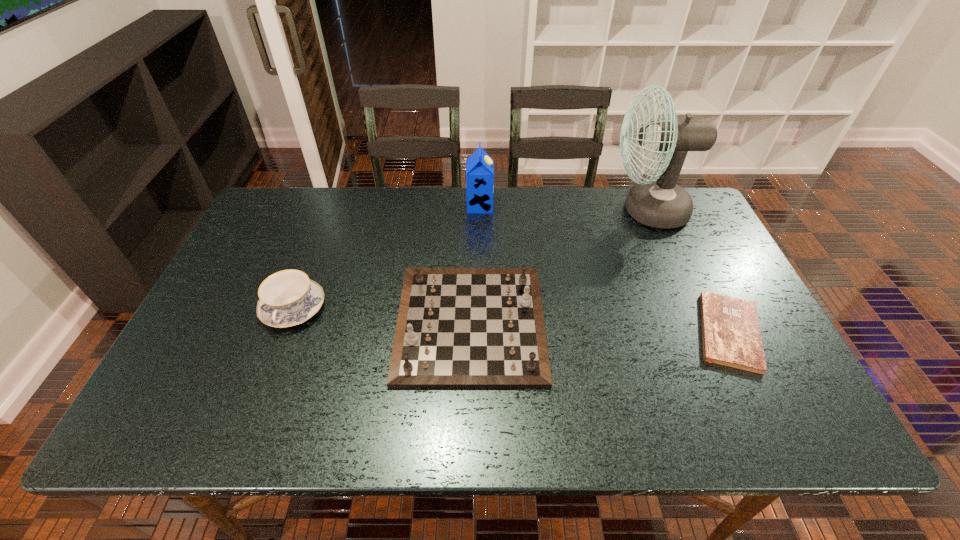
I want to click on the tallest object, so click(x=659, y=203).

This screenshot has height=540, width=960. I want to click on the fourth shortest object, so click(479, 166).

This screenshot has height=540, width=960. What are the coordinates of `chinaware` in the screenshot? It's located at (287, 298).

Find the location of a particular element. The image size is (960, 540). chessboard is located at coordinates (457, 327).

Identify the location of Bible. The image size is (960, 540). (731, 336).

Image resolution: width=960 pixels, height=540 pixels. Find the location of `vacant area located 0.380m in front of the fan where the airflow is directed`. vacant area located 0.380m in front of the fan where the airflow is directed is located at coordinates (488, 211).

You are a GUI agent. You are given a task and a screenshot of the screen. Output one action in this format:
    pyautogui.click(x=<x>, y=<y>)
    Task: Click on the free space located in front of the fan where the airflow is directed
    
    Given the screenshot: What is the action you would take?
    pyautogui.click(x=584, y=211)

The width and height of the screenshot is (960, 540). Find the location of `free space located in front of the fan where the airflow is directed`. free space located in front of the fan where the airflow is directed is located at coordinates (538, 211).

At what (x,y) coordinates should I click in order to perform the action: click on vacant space situated 0.250m with the cap open on the carton. Please return your answer as a coordinate pair (x, y). The image size is (960, 540). Looking at the image, I should click on (569, 206).

You are a GUI agent. You are given a task and a screenshot of the screen. Output one action in this format:
    pyautogui.click(x=<x>, y=<y>)
    Task: Click on the vacant space located with the handle on the side of the leftmost object
    This screenshot has height=540, width=960.
    Given the screenshot: What is the action you would take?
    pyautogui.click(x=276, y=353)